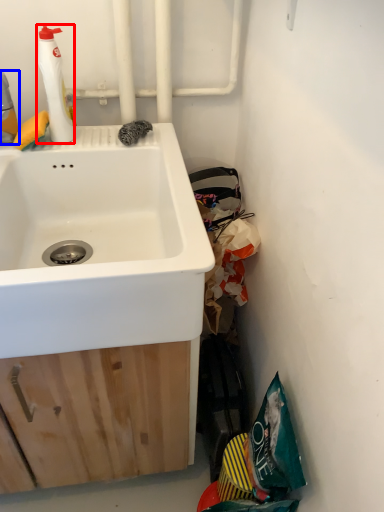
Question: Among these objects, which one is nearest to the camera, cleaning product (highlighted by a red box) or cleaning product (highlighted by a blue box)?

Choices:
 (A) cleaning product
 (B) cleaning product

Answer: (B)